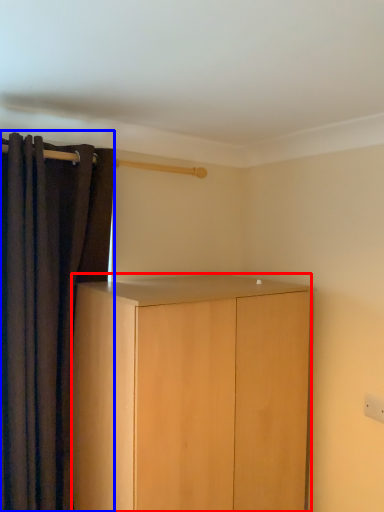
Question: Which object appears farthest to the camera in this image, cabinetry (highlighted by a red box) or curtain (highlighted by a blue box)?

Choices:
 (A) cabinetry
 (B) curtain

Answer: (B)